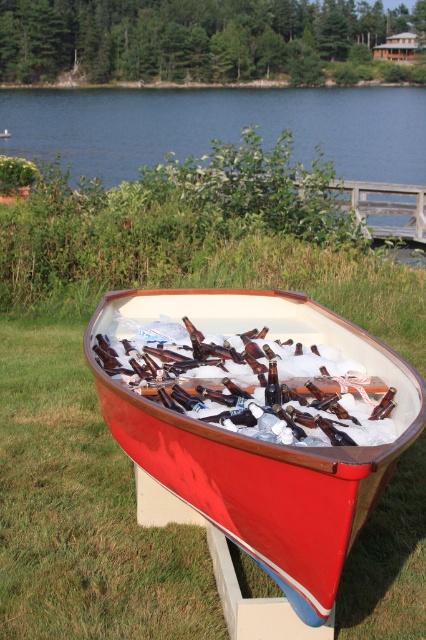
Question: Observing the image, what is the correct spatial positioning of shiny red canoe at center in reference to blue water at upper center?

Choices:
 (A) below
 (B) above

Answer: (A)

Question: Does shiny red canoe at center appear under blue water at upper center?

Choices:
 (A) no
 (B) yes

Answer: (B)

Question: Does shiny red canoe at center have a larger size compared to blue water at upper center?

Choices:
 (A) yes
 (B) no

Answer: (B)

Question: Which object is farther from the camera taking this photo?

Choices:
 (A) blue water at upper center
 (B) shiny red canoe at center

Answer: (A)

Question: Which of the following is the closest to the observer?

Choices:
 (A) blue water at upper center
 (B) shiny red canoe at center

Answer: (B)